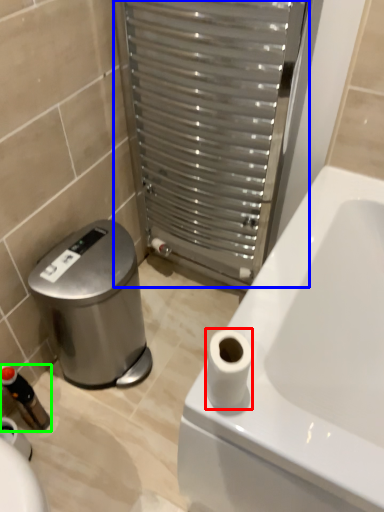
Question: Which object is positioned farthest from toilet paper (highlighted by a red box)? Select from screen door (highlighted by a blue box) and toiletry (highlighted by a green box).

Choices:
 (A) screen door
 (B) toiletry

Answer: (B)